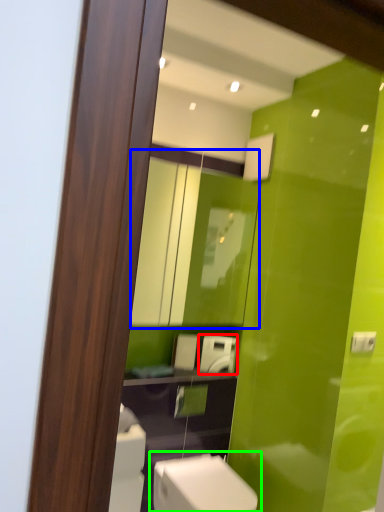
Question: Considering the real-world distances, which object is closest to appliance (highlighted by a red box)? mirror (highlighted by a blue box) or toilet (highlighted by a green box).

Choices:
 (A) mirror
 (B) toilet

Answer: (A)